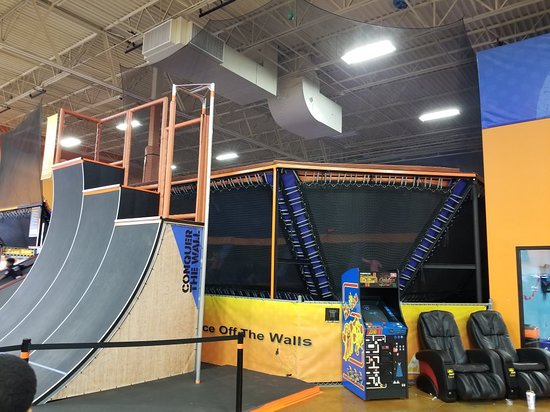
Locate an element on the screen. This screenshot has width=550, height=412. light is located at coordinates [370, 48].